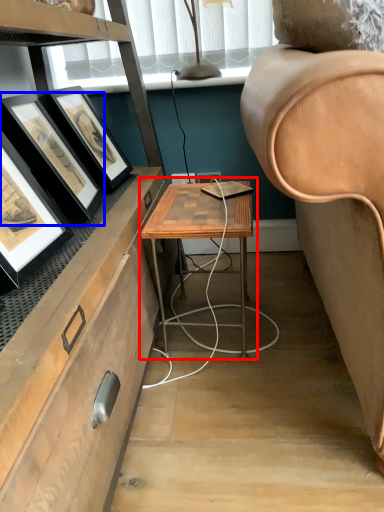
Question: Which point is closer to the camera, table (highlighted by a red box) or picture frame (highlighted by a blue box)?

Choices:
 (A) table
 (B) picture frame

Answer: (B)